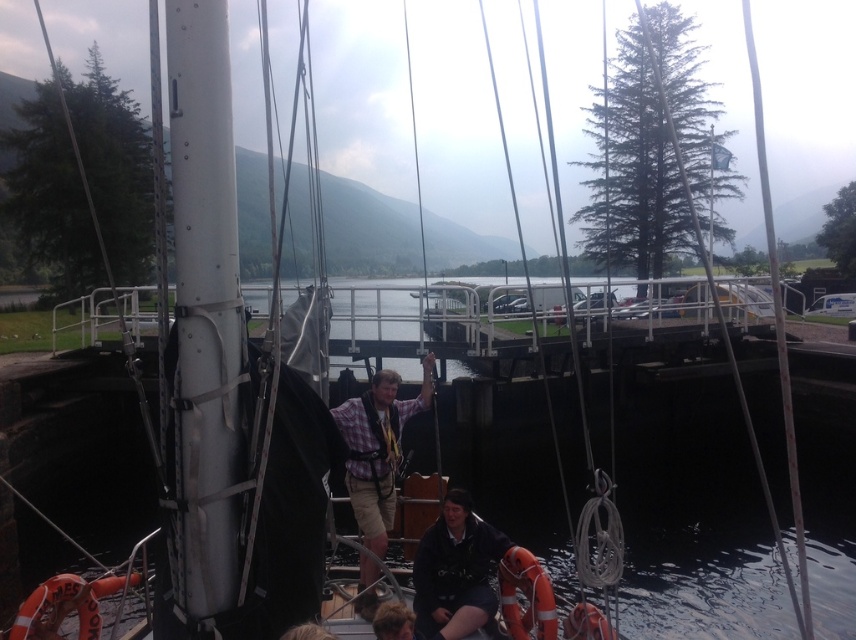
Question: Is plaid fabric shirt at center positioned in front of brown hair at lower center?

Choices:
 (A) no
 (B) yes

Answer: (A)

Question: Which point is farther to the camera?

Choices:
 (A) plaid fabric shirt at center
 (B) brown hair at lower center
 (C) dark blue fabric at lower center

Answer: (A)

Question: Which object is closer to the camera taking this photo?

Choices:
 (A) brown hair at lower center
 (B) dark blue fabric at lower center
 (C) plaid fabric shirt at center

Answer: (A)

Question: Does plaid fabric shirt at center have a greater width compared to dark blue fabric at lower center?

Choices:
 (A) no
 (B) yes

Answer: (B)

Question: Does dark blue fabric at lower center have a greater width compared to brown hair at lower center?

Choices:
 (A) no
 (B) yes

Answer: (B)

Question: Which object appears closest to the camera in this image?

Choices:
 (A) dark blue fabric at lower center
 (B) plaid fabric shirt at center
 (C) brown hair at lower center

Answer: (C)